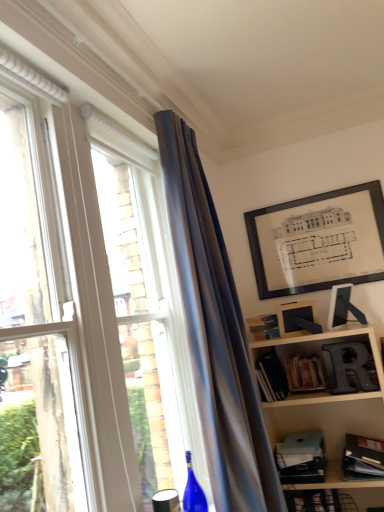
This screenshot has width=384, height=512. What do you see at coordinates (301, 457) in the screenshot?
I see `matte blue paperback book at lower right, which ranks as the second paperback book in top-to-bottom order` at bounding box center [301, 457].

You are a GUI agent. You are given a task and a screenshot of the screen. Output one action in this format:
    pyautogui.click(x=<x>, y=<y>)
    Task: Click on the hardcover book at lower right, the third book when ordered from left to right
    The image size is (384, 512).
    Given the screenshot: What is the action you would take?
    pyautogui.click(x=363, y=457)

This screenshot has height=512, width=384. I want to click on blue glass wine bottle at lower center, so click(x=193, y=490).

Does hardcover books at lower right, acting as the second book starting from the left, have a greater width compared to metallic silver letter r at lower right?

Yes.

Does hardcover books at lower right, the second book positioned from the right, turn towards metallic silver letter r at lower right?

No, hardcover books at lower right, the second book positioned from the right, is not oriented towards metallic silver letter r at lower right.

Who is smaller, hardcover books at lower right, placed as the 1th book when sorted from top to bottom, or metallic silver letter r at lower right?

Smaller between the two is metallic silver letter r at lower right.

Would you consider blue glass wine bottle at lower center to be distant from matte glass window at left?

blue glass wine bottle at lower center is far away from matte glass window at left.

In order to click on window above the blue glass wine bottle at lower center (from a real-world perspective) in this screenshot , I will do click(95, 191).

Considering the positions of point (190, 479) and point (56, 110), is point (190, 479) closer or farther from the camera than point (56, 110)?

Clearly, point (190, 479) is more distant from the camera than point (56, 110).

Is matte glass window at left inside blue glass wine bottle at lower center?

No, matte glass window at left is not inside blue glass wine bottle at lower center.

Considering the relative sizes of matte blue paperback book at lower right, which ranks as the 1th paperback book in bottom-to-top order, and hardcover books at lower right, acting as the second book starting from the left, in the image provided, is matte blue paperback book at lower right, which ranks as the 1th paperback book in bottom-to-top order, shorter than hardcover books at lower right, acting as the second book starting from the left,?

Correct, matte blue paperback book at lower right, which ranks as the 1th paperback book in bottom-to-top order, is not as tall as hardcover books at lower right, acting as the second book starting from the left.

From a real-world perspective, is matte blue paperback book at lower right, which ranks as the second paperback book in top-to-bottom order, on top of hardcover books at lower right, the second book positioned from the right?

No, from a real-world perspective, matte blue paperback book at lower right, which ranks as the second paperback book in top-to-bottom order, is not above hardcover books at lower right, the second book positioned from the right.

Is matte blue paperback book at lower right, which ranks as the second paperback book in top-to-bottom order, oriented away from hardcover books at lower right, acting as the second book starting from the left?

No.

Is matte blue paperback book at lower right, which ranks as the second paperback book in top-to-bottom order, situated inside blue glass wine bottle at lower center or outside?

matte blue paperback book at lower right, which ranks as the second paperback book in top-to-bottom order, is spatially situated outside blue glass wine bottle at lower center.

Looking at the image, does matte blue paperback book at lower right, which ranks as the 1th paperback book in bottom-to-top order, seem bigger or smaller compared to blue glass wine bottle at lower center?

In the image, matte blue paperback book at lower right, which ranks as the 1th paperback book in bottom-to-top order, appears to be larger than blue glass wine bottle at lower center.

In the scene shown: Are matte blue paperback book at lower right, which ranks as the 1th paperback book in bottom-to-top order, and blue glass wine bottle at lower center located far from each other?

Actually, matte blue paperback book at lower right, which ranks as the 1th paperback book in bottom-to-top order, and blue glass wine bottle at lower center are a little close together.

From a real-world perspective, is matte blue paperback book at lower right, which ranks as the 1th paperback book in bottom-to-top order, positioned under blue glass wine bottle at lower center based on gravity?

Yes, from a real-world perspective, matte blue paperback book at lower right, which ranks as the 1th paperback book in bottom-to-top order, is below blue glass wine bottle at lower center.

Between hardcover book at lower right, the 1th book ordered from the bottom, and matte glass window at left, which one appears on the left side from the viewer's perspective?

matte glass window at left.

Is hardcover book at lower right, the 3th book positioned from the top, wider or thinner than matte glass window at left?

In the image, hardcover book at lower right, the 3th book positioned from the top, appears to be wider than matte glass window at left.

From a real-world perspective, is hardcover book at lower right, the third book when ordered from left to right, located higher than matte glass window at left?

No.

What's the angular difference between hardcover book at lower right, the 3th book positioned from the top, and matte glass window at left's facing directions?

The angle between the facing direction of hardcover book at lower right, the 3th book positioned from the top, and the facing direction of matte glass window at left is 86.9 degrees.

Is point (341, 371) positioned before point (204, 505)?

No, (341, 371) is further to viewer.

Is metallic silver letter r at lower right positioned with its back to blue glass wine bottle at lower center?

metallic silver letter r at lower right does not have its back to blue glass wine bottle at lower center.

Consider the image. From a real-world perspective, relative to blue glass wine bottle at lower center, is metallic silver letter r at lower right vertically above or below?

metallic silver letter r at lower right is situated higher than blue glass wine bottle at lower center in the real world.

Is blue glass wine bottle at lower center located within metallic silver letter r at lower right?

Definitely not — blue glass wine bottle at lower center is not inside metallic silver letter r at lower right.

Does hardcover book at center, arranged as the 1th paperback book when viewed from the top, appear on the right side of metallic silver letter r at lower right?

Incorrect, hardcover book at center, arranged as the 1th paperback book when viewed from the top, is not on the right side of metallic silver letter r at lower right.

From the image's perspective, who appears lower, hardcover book at center, positioned as the second paperback book in bottom-to-top order, or metallic silver letter r at lower right?

metallic silver letter r at lower right.

Based on their sizes in the image, would you say hardcover book at center, arranged as the 1th paperback book when viewed from the top, is bigger or smaller than metallic silver letter r at lower right?

Considering their sizes, hardcover book at center, arranged as the 1th paperback book when viewed from the top, takes up less space than metallic silver letter r at lower right.

You are a GUI agent. You are given a task and a screenshot of the screen. Output one action in this format:
    pyautogui.click(x=<x>, y=<y>)
    Task: Click on the speaker above the hardcover books at lower right, acting as the second book starting from the left (from the image's perspective)
    
    Given the screenshot: What is the action you would take?
    pyautogui.click(x=349, y=366)

Identify the location of wine bottle on the right of matte glass window at left. (193, 490).

Which object lies nearer to the anchor point hardcover books at lower right, placed as the 1th book when sorted from top to bottom, hardcover book at lower right, the 1th book ordered from the bottom, or hardcover book at center-right, which ranks as the 2th book in bottom-to-top order?

hardcover book at center-right, which ranks as the 2th book in bottom-to-top order.

Based on their spatial positions, is matte blue paperback book at lower right, which ranks as the 1th paperback book in bottom-to-top order, or hardcover books at lower right, which is counted as the 3th book, starting from the bottom, further from hardcover book at center, positioned as the second paperback book in bottom-to-top order?

The object further to hardcover book at center, positioned as the second paperback book in bottom-to-top order, is matte blue paperback book at lower right, which ranks as the 1th paperback book in bottom-to-top order.

From the picture: Based on their spatial positions, is hardcover book at center-right, which is the 3th book from right to left, or hardcover book at center, arranged as the 1th paperback book when viewed from the top, closer to hardcover book at lower right, the 1th book ordered from the bottom?

hardcover book at center-right, which is the 3th book from right to left.

Which object lies nearer to the anchor point matte blue paperback book at lower right, which ranks as the 1th paperback book in bottom-to-top order, silky blue curtain at upper center or hardcover books at lower right, which is counted as the 3th book, starting from the bottom?

hardcover books at lower right, which is counted as the 3th book, starting from the bottom, is closer to matte blue paperback book at lower right, which ranks as the 1th paperback book in bottom-to-top order.

From the image, which object appears to be nearer to hardcover book at lower right, the 1th book ordered from the bottom, metallic silver letter r at lower right or matte blue paperback book at lower right, which ranks as the second paperback book in top-to-bottom order?

matte blue paperback book at lower right, which ranks as the second paperback book in top-to-bottom order, lies closer to hardcover book at lower right, the 1th book ordered from the bottom, than the other object.

Estimate the real-world distances between objects in this image. Which object is further from silky blue curtain at upper center, hardcover book at center, positioned as the second paperback book in bottom-to-top order, or blue glass wine bottle at lower center?

Among the two, hardcover book at center, positioned as the second paperback book in bottom-to-top order, is located further to silky blue curtain at upper center.

Looking at the image, which one is located closer to hardcover book at center-right, which is the 1th book from left to right, matte glass window at left or silky blue curtain at upper center?

silky blue curtain at upper center is positioned closer to the anchor hardcover book at center-right, which is the 1th book from left to right.

Estimate the real-world distances between objects in this image. Which object is closer to metallic silver letter r at lower right, hardcover book at center, positioned as the second paperback book in bottom-to-top order, or silky blue curtain at upper center?

The object closer to metallic silver letter r at lower right is hardcover book at center, positioned as the second paperback book in bottom-to-top order.

Where is `book between matte glass window at left and matte blue paperback book at lower right, which ranks as the 1th paperback book in bottom-to-top order, from front to back`? Image resolution: width=384 pixels, height=512 pixels. book between matte glass window at left and matte blue paperback book at lower right, which ranks as the 1th paperback book in bottom-to-top order, from front to back is located at coordinates (363, 457).

Identify the location of paperback book between blue glass wine bottle at lower center and hardcover book at center-right, which is the 1th book from left to right, along the z-axis. (301, 457).

This screenshot has height=512, width=384. I want to click on paperback book located between matte glass window at left and hardcover book at center-right, which is the 3th book from right to left, in the depth direction, so click(x=301, y=457).

The width and height of the screenshot is (384, 512). What are the coordinates of `curtain located between matte glass window at left and hardcover book at lower right, the first book from the right, in the left-right direction` in the screenshot? It's located at (215, 333).